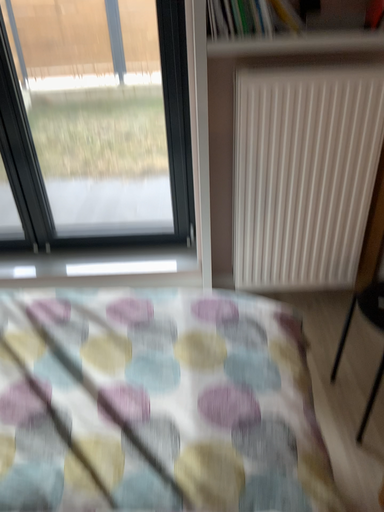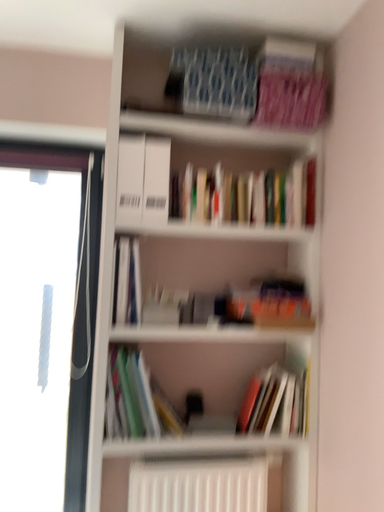
Question: How did the camera likely rotate when shooting the video?

Choices:
 (A) rotated right
 (B) rotated left

Answer: (A)